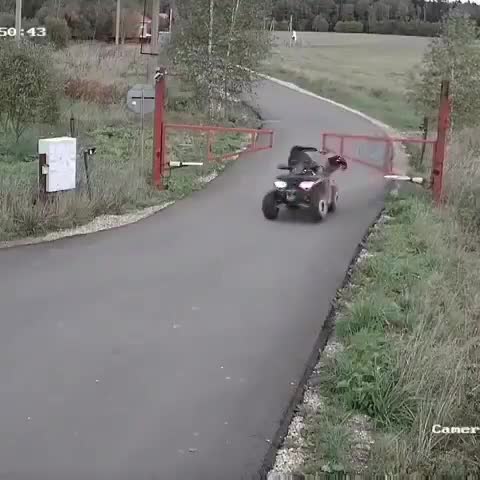
Image resolution: width=480 pixels, height=480 pixels. I want to click on seat, so pyautogui.click(x=296, y=175).